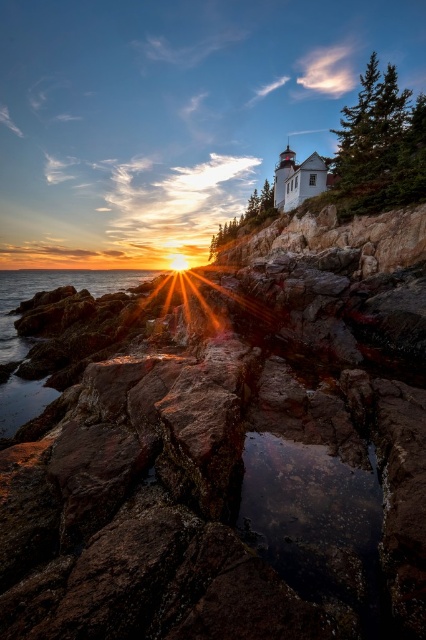
You are standing at the point marked by the coordinates point (224,444) in the image. What type of terrain are you currently standing on?

You are standing on rusty stone rocks at center.

You are a photographer aiming to capture the reflection of the rusty stone rocks at center and the translucent wet rocks at lower left in the water. Which rocks would you focus on first if you want to ensure both reflections are visible in your shot?

The translucent wet rocks at lower left should be focused on first because they are positioned above the rusty stone rocks at center, making their reflections more likely to be visible in the water.

You are a photographer wanting to capture the reflection of the rusty stone rocks at center and the translucent wet rocks at lower left. Which one do you need to position yourself closer to the water to photograph?

You need to position yourself closer to the water to photograph the translucent wet rocks at lower left because they are located at lower left, which is closer to the water than the rusty stone rocks at center.